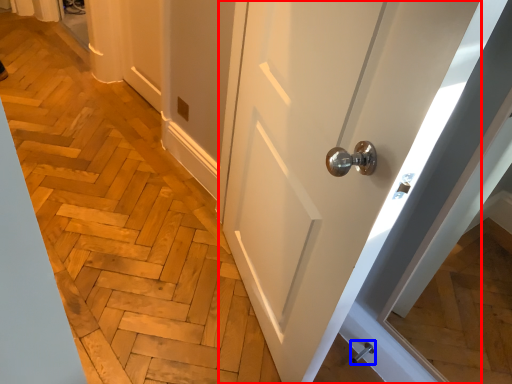
Question: Which of the following is the farthest to the observer, door (highlighted by a red box) or door handle (highlighted by a blue box)?

Choices:
 (A) door
 (B) door handle

Answer: (B)